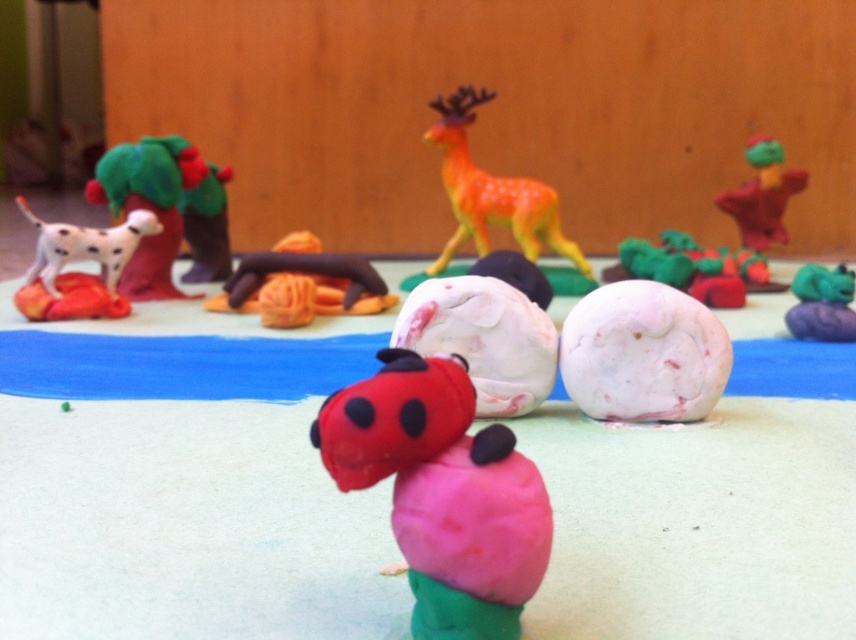
Looking at this image, you are an art curator arranging an exhibition. You need to place a new sculpture between the brown clay bear at center and the green clay rock at lower right. Based on their positions, where should you position the new sculpture to maintain the existing layout?

The brown clay bear at center is above the green clay rock at lower right, so to maintain the existing layout, position the new sculpture between them vertically, placing it below the brown clay bear at center and above the green clay rock at lower right.

You are an artist arranging sculptures. You need to place a new sculpture between the brown clay bear at center and the green clay rock at lower right. Based on their positions, which side should you place it on to keep it aligned with their arrangement?

Since the brown clay bear at center is to the left of the green clay rock at lower right, you should place the new sculpture between them on the right side of the brown clay bear at center and the left side of the green clay rock at lower right to maintain alignment.

You are a sculptor who wants to place a new sculpture between the white matte ball at center and the matte orange dog at left. Based on their positions, which direction should you move from the dog to reach the ball?

The white matte ball at center is to the right of the matte orange dog at left, so you should move to the right from the dog to reach the ball.